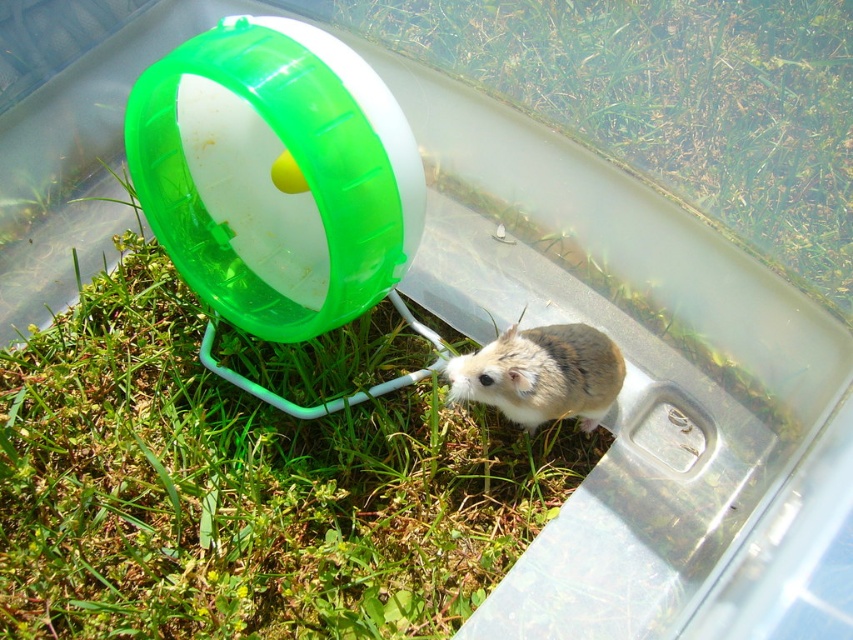
You are a small insect trying to cross from the green grass at lower left to the fuzzy brown hamster at center. Considering their widths, which path would be wider for your journey?

The green grass at lower left has a greater width than the fuzzy brown hamster at center, so the path near the green grass at lower left would be wider for your journey.

Looking at this image, you are holding a 1.2 meter long garden hose. You want to water the green grass at lower left without moving the hose. Can you reach it from your current position?

The green grass at lower left is 1.12 meters from camera. Since the garden hose is 1.2 meters long, you can reach it without moving the hose.